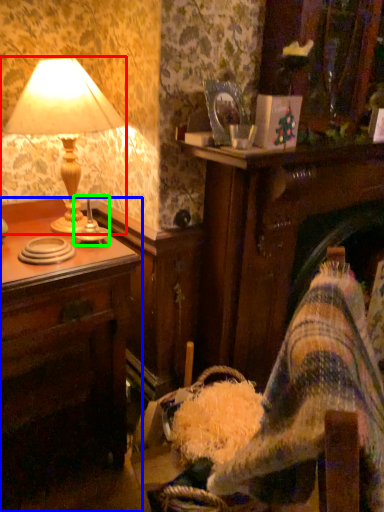
Question: Estimate the real-world distances between objects in this image. Which object is farther from lamp (highlighted by a red box), desk (highlighted by a blue box) or candle holder (highlighted by a green box)?

Choices:
 (A) desk
 (B) candle holder

Answer: (A)